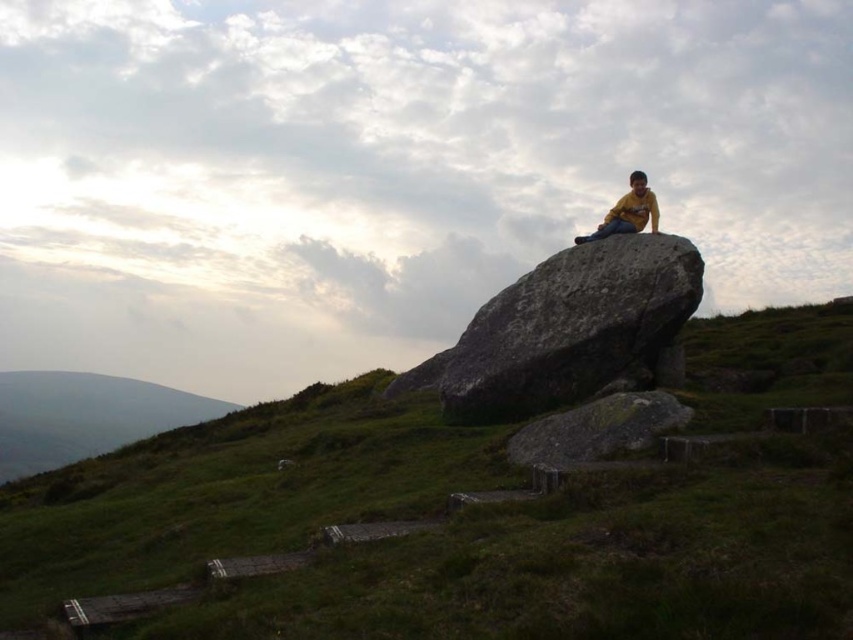
You are planning to place a picnic blanket on the gray rough boulder at upper center or the green grassy hillside at lower left. Considering their sizes, which location would allow the blanket to be placed without overlapping the edges?

The green grassy hillside at lower left is larger than the gray rough boulder at upper center, so placing the picnic blanket there would prevent it from overlapping the edges.